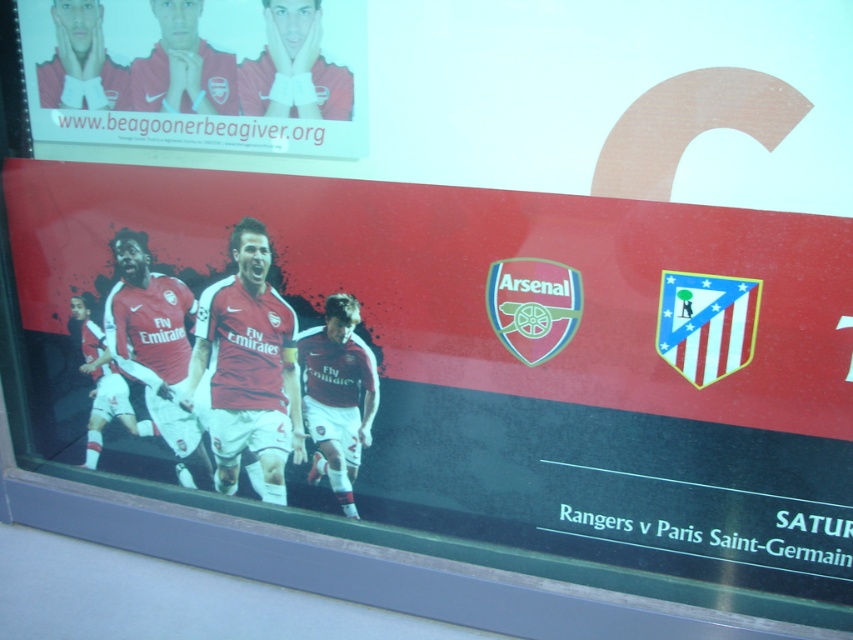
In the scene shown: Who is more distant from viewer, (x=273, y=371) or (x=76, y=54)?

Point (x=273, y=371)

What do you see at coordinates (459, 358) in the screenshot?
I see `matte red jersey at center` at bounding box center [459, 358].

You are a GUI agent. You are given a task and a screenshot of the screen. Output one action in this format:
    pyautogui.click(x=<x>, y=<y>)
    Task: Click on the matte red jersey at center
    Image resolution: width=853 pixels, height=640 pixels.
    Given the screenshot: What is the action you would take?
    pyautogui.click(x=459, y=358)